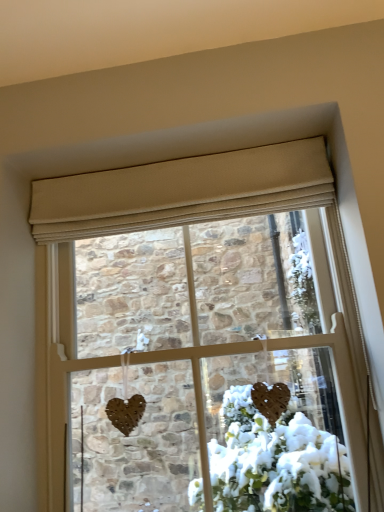
In order to click on vacant location below beige fabric curtain at upper center (from a real-world perspective) in this screenshot , I will do `click(190, 222)`.